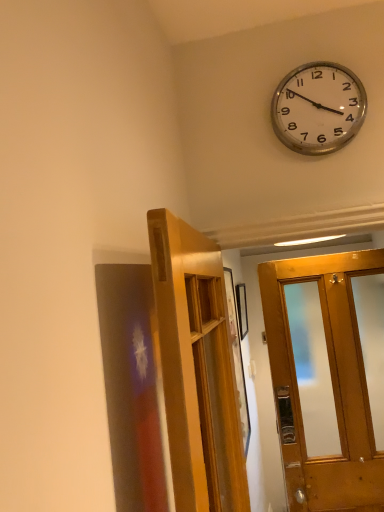
Question: From the image's perspective, is wooden door at center located above or below silver metallic clock at upper right?

Choices:
 (A) above
 (B) below

Answer: (B)

Question: Considering the positions of point (162, 366) and point (322, 88), is point (162, 366) closer or farther from the camera than point (322, 88)?

Choices:
 (A) closer
 (B) farther

Answer: (A)

Question: Do you think wooden door at center is within silver metallic clock at upper right, or outside of it?

Choices:
 (A) inside
 (B) outside

Answer: (B)

Question: From their relative heights in the image, would you say silver metallic clock at upper right is taller or shorter than wooden door at center?

Choices:
 (A) tall
 (B) short

Answer: (B)

Question: Would you say silver metallic clock at upper right is inside or outside wooden door at center?

Choices:
 (A) outside
 (B) inside

Answer: (A)

Question: Relative to wooden door at center, is silver metallic clock at upper right in front or behind?

Choices:
 (A) behind
 (B) front

Answer: (A)

Question: Does point (319, 93) appear closer or farther from the camera than point (190, 242)?

Choices:
 (A) closer
 (B) farther

Answer: (B)